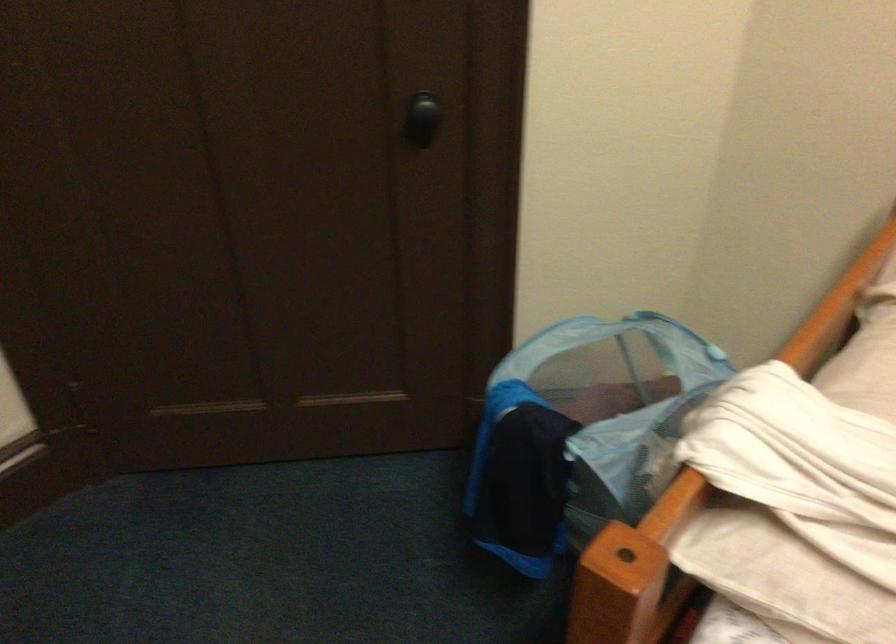
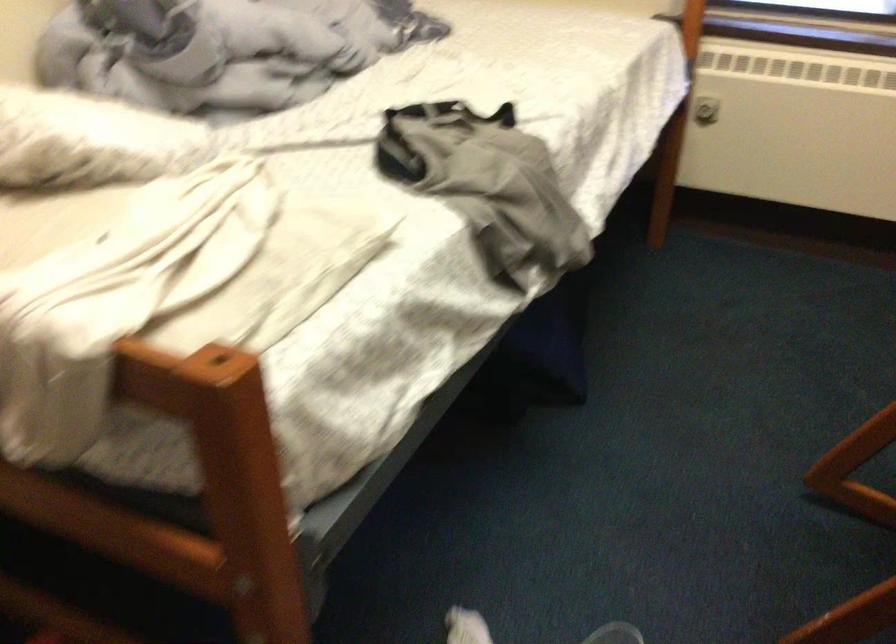
The first image is from the beginning of the video and the second image is from the end. How did the camera likely rotate when shooting the video?

The rotation direction of the camera is right-down.